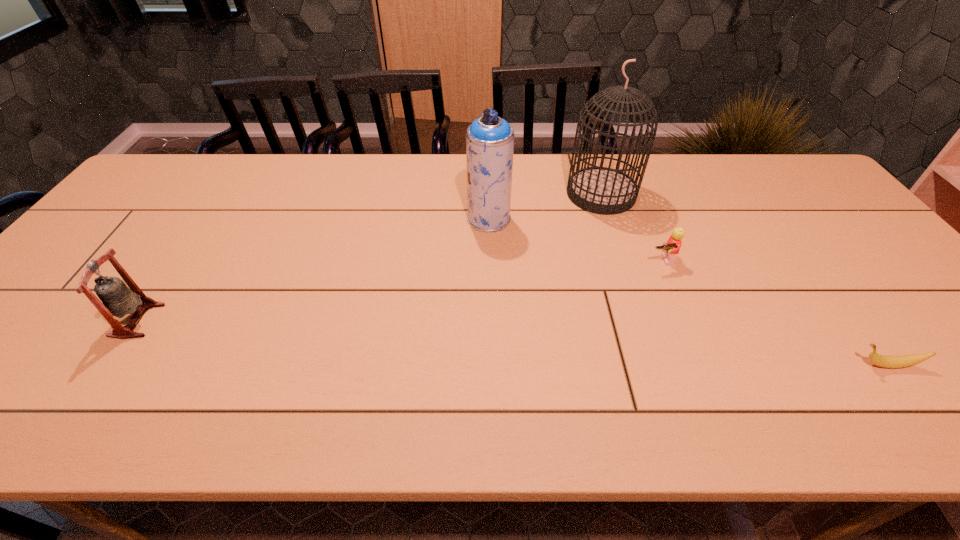
I want to click on free space located 0.070m on the front of the second object from left to right, so tap(490, 249).

Where is `free spot located 0.310m on the right of the leftmost object`? Image resolution: width=960 pixels, height=540 pixels. free spot located 0.310m on the right of the leftmost object is located at coordinates (289, 320).

The image size is (960, 540). I want to click on vacant region located in front of the fourth tallest object with the accessory visible, so click(684, 318).

Where is `vacant space located at the stem of the shortest object`? This screenshot has width=960, height=540. vacant space located at the stem of the shortest object is located at coordinates (749, 365).

What are the coordinates of `vacant space located at the stem of the shortest object` in the screenshot? It's located at (754, 365).

Locate an element on the screen. This screenshot has width=960, height=540. free space located 0.070m at the stem of the shortest object is located at coordinates (819, 365).

The image size is (960, 540). What are the coordinates of `object present at the far edge` in the screenshot? It's located at (600, 190).

The image size is (960, 540). I want to click on object that is at the right edge, so click(887, 361).

This screenshot has height=540, width=960. Identify the location of free point at the far edge. click(x=375, y=195).

The image size is (960, 540). What are the coordinates of `free space at the left edge of the desktop` in the screenshot? It's located at (119, 255).